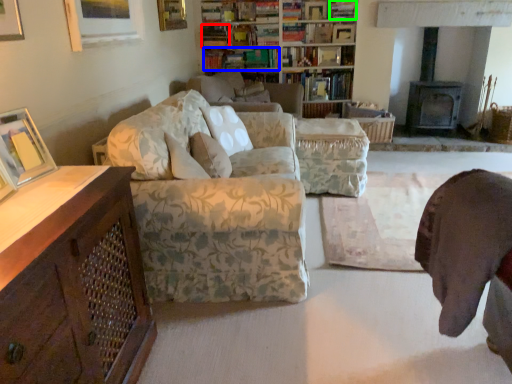
Question: Which object is the closest to the book (highlighted by a red box)? Choose among these: book (highlighted by a blue box) or book (highlighted by a green box).

Choices:
 (A) book
 (B) book

Answer: (A)